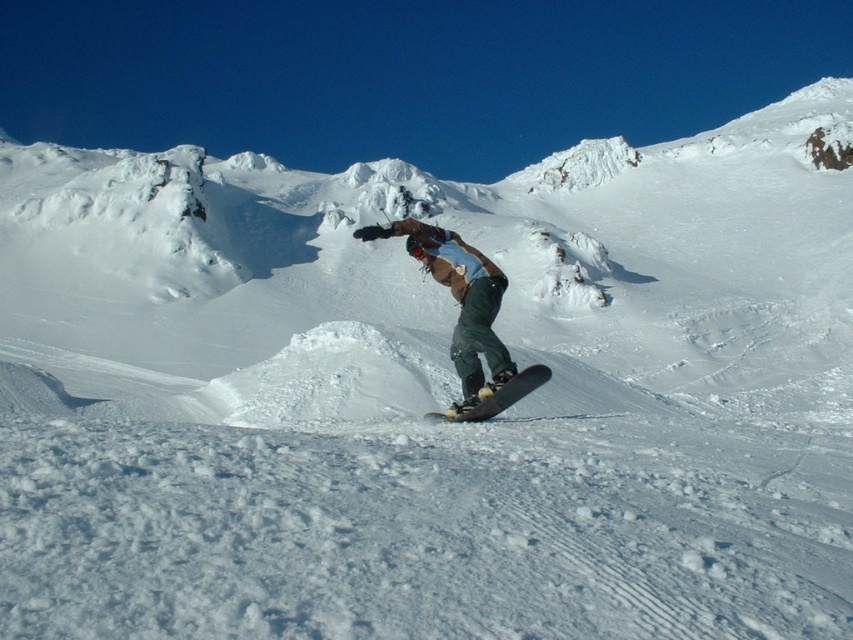
Question: Can you confirm if green fabric snowboarder at center is positioned above black matte snowboard at center?

Choices:
 (A) no
 (B) yes

Answer: (B)

Question: Can you confirm if green fabric snowboarder at center is wider than black matte snowboard at center?

Choices:
 (A) yes
 (B) no

Answer: (A)

Question: Which of the following is the closest to the observer?

Choices:
 (A) black matte snowboard at center
 (B) green fabric snowboarder at center

Answer: (B)

Question: Is green fabric snowboarder at center smaller than black matte snowboard at center?

Choices:
 (A) no
 (B) yes

Answer: (A)